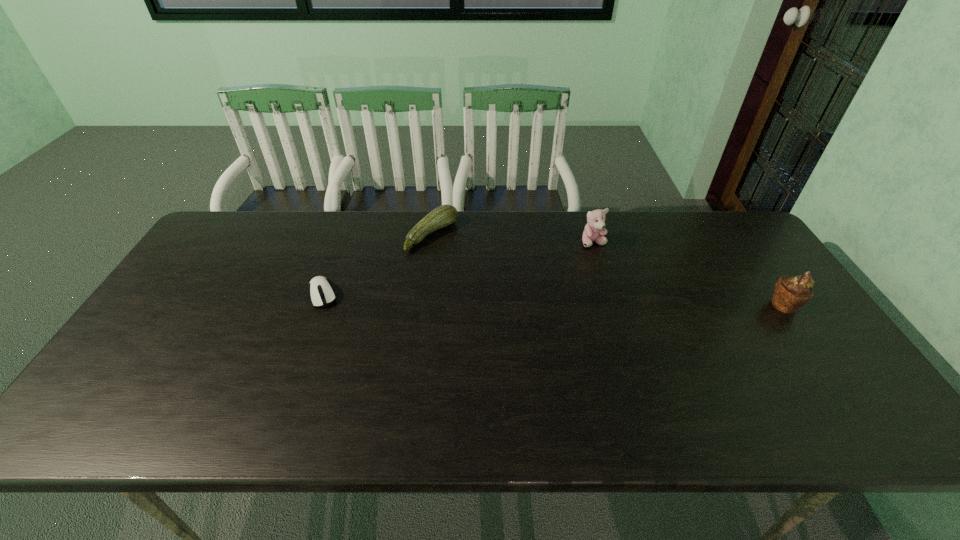
The height and width of the screenshot is (540, 960). Identify the location of free spot on the desktop that is between the mouse and the muffin and is positioned at the face of the third object from left to right. (606, 301).

This screenshot has height=540, width=960. Find the location of `free space on the desktop that is between the mouse and the muffin and is positioned at the stem end of the second object from left to right`. free space on the desktop that is between the mouse and the muffin and is positioned at the stem end of the second object from left to right is located at coordinates (540, 299).